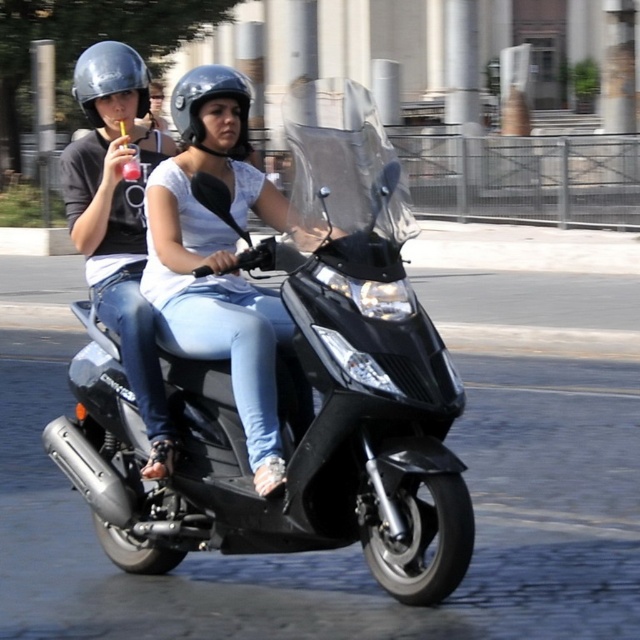
Question: Which of the following is the farthest from the observer?

Choices:
 (A) (232, 96)
 (B) (253, 433)
 (C) (106, 92)

Answer: (C)

Question: Which point is farther to the camera?

Choices:
 (A) (266, 332)
 (B) (186, 77)
 (C) (372, 122)
 (D) (88, 58)

Answer: (D)

Question: Does black matte scooter at center lie in front of shiny silver helmet at upper left?

Choices:
 (A) no
 (B) yes

Answer: (B)

Question: Is black matte scooter at center further to camera compared to matte white helmet at upper center?

Choices:
 (A) no
 (B) yes

Answer: (A)

Question: Is the position of matte black helmet at upper left more distant than that of matte black helmet at center?

Choices:
 (A) no
 (B) yes

Answer: (B)

Question: Which point is closer to the camera taking this photo?

Choices:
 (A) click(x=244, y=145)
 (B) click(x=141, y=74)
 (C) click(x=115, y=115)

Answer: (A)